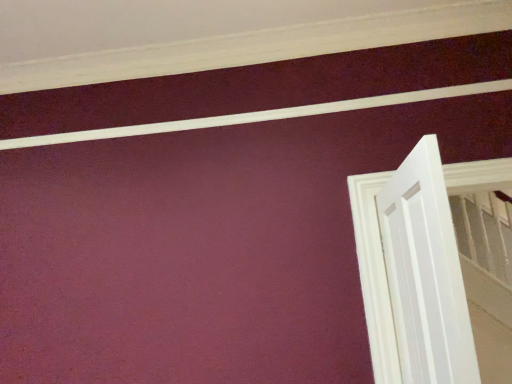
What are the coordinates of `white smooth door at right` in the screenshot? It's located at (425, 272).

Measure the distance between white smooth door at right and camera.

white smooth door at right and camera are 1.04 meters apart.

This screenshot has height=384, width=512. Describe the element at coordinates (425, 272) in the screenshot. I see `white smooth door at right` at that location.

Locate an element on the screen. The width and height of the screenshot is (512, 384). white smooth door at right is located at coordinates (425, 272).